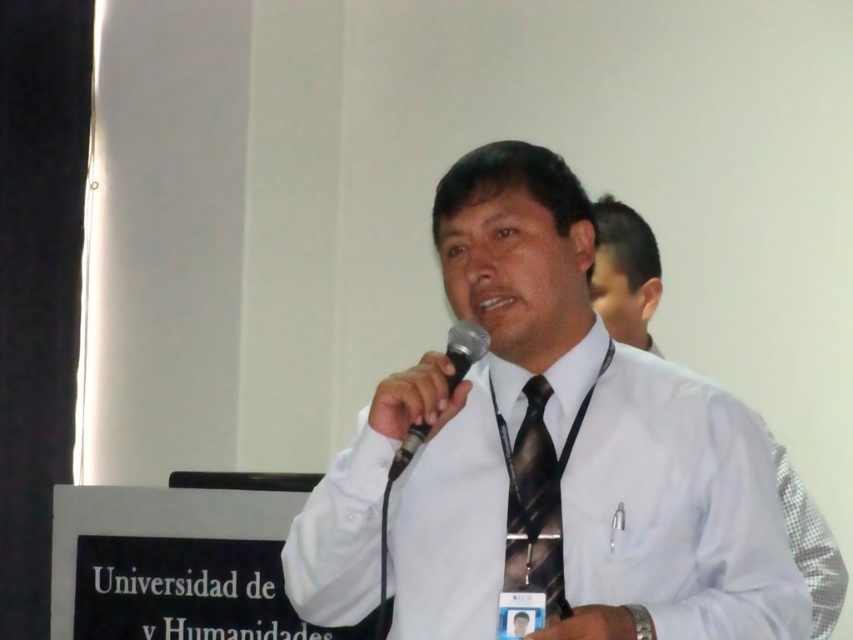
In the scene shown: You are a photographer setting up for a portrait. You need to ensure that the black striped tie at center and the black plastic microphone at center are both in focus. The depth of field in your camera can cover objects within 7 inches. Will both items be in focus?

The distance between the black striped tie at center and the black plastic microphone at center is 7.68 inches. Since the depth of field can only cover 7 inches, the two items are slightly out of the depth of field range. Therefore, both items may not be in focus simultaneously.

You are an event organizer and need to arrange two white shirts for a presentation. You have the white glossy shirt at center and the white shirt at center. According to the scene, which shirt is positioned to the left of the other?

The white glossy shirt at center is positioned on the left side of white shirt at center.